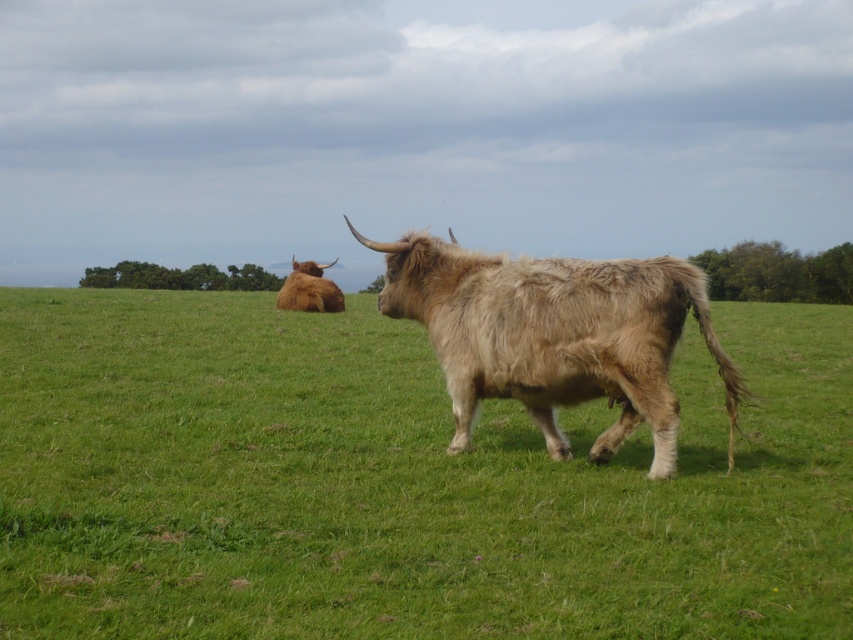
Who is more distant from viewer, (672,376) or (521,317)?

Point (672,376)

Is green soft grass at center taller than fuzzy beige buffalo at center?

Correct, green soft grass at center is much taller as fuzzy beige buffalo at center.

The height and width of the screenshot is (640, 853). Identify the location of green soft grass at center. (399, 483).

You are a GUI agent. You are given a task and a screenshot of the screen. Output one action in this format:
    pyautogui.click(x=<x>, y=<y>)
    Task: Click on the fuzzy beige buffalo at center
    This screenshot has width=853, height=640.
    Given the screenshot: What is the action you would take?
    pyautogui.click(x=555, y=336)

Is point (627, 262) closer to viewer compared to point (320, 298)?

Yes.

Image resolution: width=853 pixels, height=640 pixels. In order to click on fuzzy beige buffalo at center in this screenshot , I will do `click(555, 336)`.

Consider the image. Between green soft grass at center and brown fuzzy yak at upper left, which one has more height?

Standing taller between the two is brown fuzzy yak at upper left.

Is green soft grass at center taller than brown fuzzy yak at upper left?

No.

Who is more distant from viewer, (842, 570) or (296, 291)?

Positioned behind is point (296, 291).

Where is `green soft grass at center`? This screenshot has height=640, width=853. green soft grass at center is located at coordinates (399, 483).